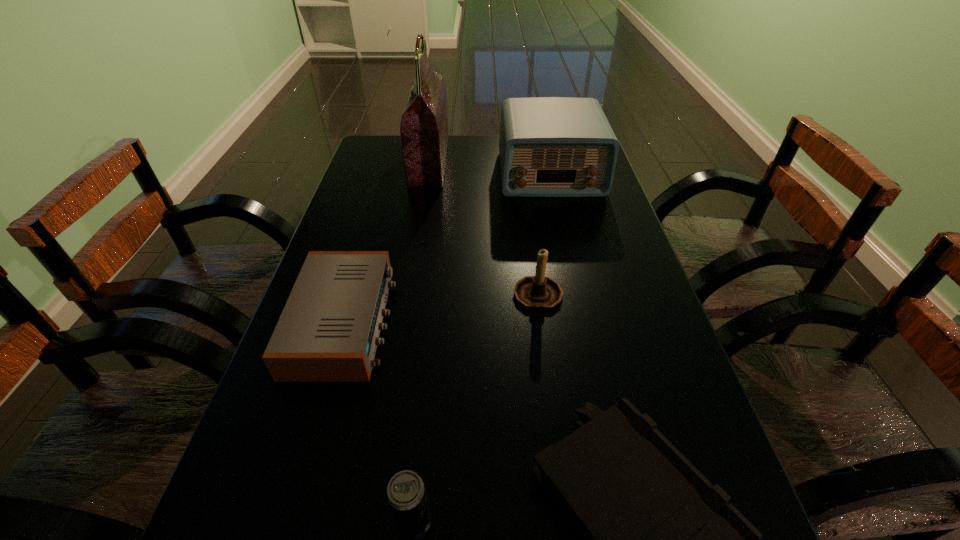
In order to click on object that stands as the fourth closest to the candle holder in this screenshot , I will do `click(424, 134)`.

The height and width of the screenshot is (540, 960). I want to click on free region that satisfies the following two spatial constraints: 1. on the front-facing side of the handbag; 2. on the right side of the beer can, so click(x=369, y=519).

Where is `free space in the image that satisfies the following two spatial constraints: 1. on the back side of the candle holder; 2. on the right side of the third shortest object`? free space in the image that satisfies the following two spatial constraints: 1. on the back side of the candle holder; 2. on the right side of the third shortest object is located at coordinates (437, 292).

Find the location of a particular element. vacant space that satisfies the following two spatial constraints: 1. on the front side of the candle holder; 2. on the front panel of the shorter radio receiver is located at coordinates (541, 322).

Image resolution: width=960 pixels, height=540 pixels. Identify the location of blank area in the image that satisfies the following two spatial constraints: 1. on the front-facing side of the handbag; 2. on the back side of the fourth shortest object. (407, 292).

Locate an element on the screen. This screenshot has height=540, width=960. free space that satisfies the following two spatial constraints: 1. on the front-facing side of the tallest object; 2. on the back side of the beer can is located at coordinates (369, 519).

In order to click on free location that satisfies the following two spatial constraints: 1. on the front-facing side of the handbag; 2. on the back side of the third shortest object in this screenshot , I will do `click(369, 519)`.

Locate an element on the screen. The height and width of the screenshot is (540, 960). free spot that satisfies the following two spatial constraints: 1. on the front side of the candle holder; 2. on the front panel of the nearer radio receiver is located at coordinates (541, 322).